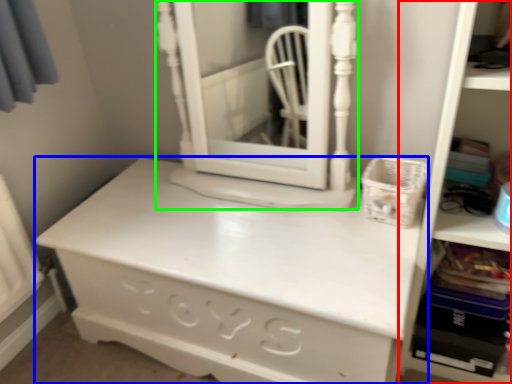
Question: Estimate the real-world distances between objects in this image. Which object is farther from bookshelf (highlighted by a red box), chest of drawers (highlighted by a blue box) or medicine cabinet (highlighted by a green box)?

Choices:
 (A) chest of drawers
 (B) medicine cabinet

Answer: (B)